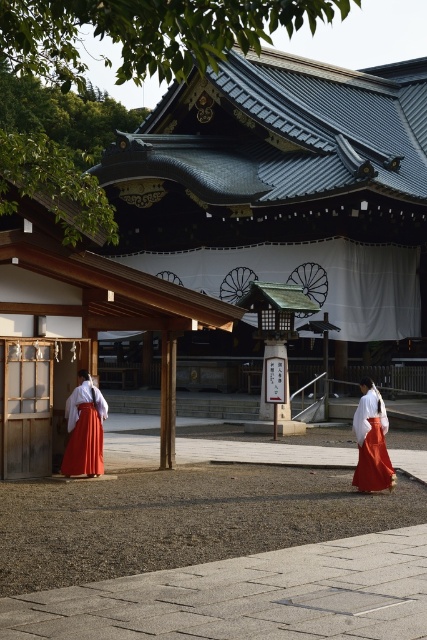
Is matte red skirt at left to the left of matte white kimono at center from the viewer's perspective?

Indeed, matte red skirt at left is positioned on the left side of matte white kimono at center.

From the picture: Who is higher up, matte red skirt at left or matte white kimono at center?

matte red skirt at left is higher up.

At what (x,y) coordinates should I click in order to perform the action: click on matte red skirt at left. Please return your answer as a coordinate pair (x, y). The image size is (427, 640). Looking at the image, I should click on (84, 429).

Where is `matte red skirt at left`? matte red skirt at left is located at coordinates (84, 429).